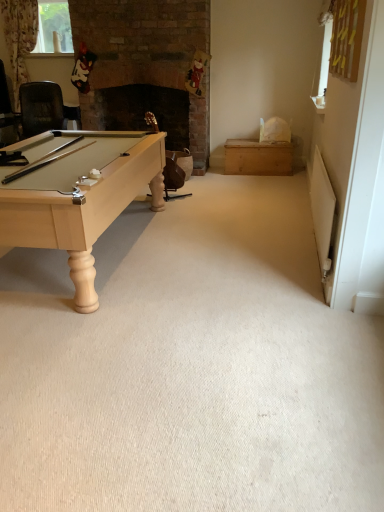
Question: Does wooden chest at right turn towards wooden swivel chair at center?

Choices:
 (A) yes
 (B) no

Answer: (A)

Question: From the image's perspective, would you say wooden chest at right is shown under wooden swivel chair at center?

Choices:
 (A) no
 (B) yes

Answer: (A)

Question: Would you say wooden chest at right is outside wooden swivel chair at center?

Choices:
 (A) no
 (B) yes

Answer: (B)

Question: Does wooden chest at right appear on the right side of wooden swivel chair at center?

Choices:
 (A) no
 (B) yes

Answer: (B)

Question: Can you confirm if wooden chest at right is thinner than wooden swivel chair at center?

Choices:
 (A) yes
 (B) no

Answer: (B)

Question: Is wooden chest at right taller than wooden swivel chair at center?

Choices:
 (A) no
 (B) yes

Answer: (A)

Question: Considering the relative sizes of wooden swivel chair at center and clear glass window at upper left in the image provided, is wooden swivel chair at center shorter than clear glass window at upper left?

Choices:
 (A) yes
 (B) no

Answer: (B)

Question: Is wooden swivel chair at center taller than clear glass window at upper left?

Choices:
 (A) yes
 (B) no

Answer: (A)

Question: Does wooden swivel chair at center have a greater width compared to clear glass window at upper left?

Choices:
 (A) no
 (B) yes

Answer: (B)

Question: From a real-world perspective, does wooden swivel chair at center sit lower than clear glass window at upper left?

Choices:
 (A) yes
 (B) no

Answer: (A)

Question: Does wooden swivel chair at center have a smaller size compared to clear glass window at upper left?

Choices:
 (A) yes
 (B) no

Answer: (B)

Question: Does wooden swivel chair at center have a lesser width compared to clear glass window at upper left?

Choices:
 (A) yes
 (B) no

Answer: (B)

Question: From the image's perspective, would you say clear glass window at upper left is shown under wooden chest at right?

Choices:
 (A) yes
 (B) no

Answer: (B)